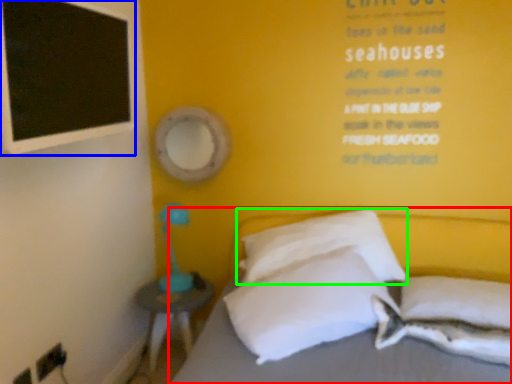
Question: Which object is positioned farthest from bed (highlighted by a red box)? Select from bulletin board (highlighted by a blue box) and pillow (highlighted by a green box).

Choices:
 (A) bulletin board
 (B) pillow

Answer: (A)